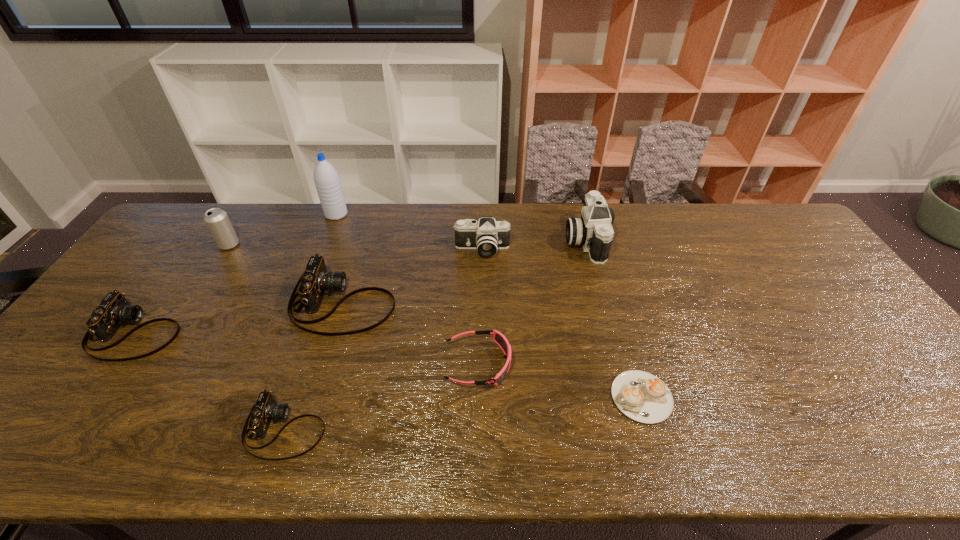
Identify the location of water bottle. The image size is (960, 540). (326, 178).

The image size is (960, 540). What are the coordinates of `blue water bottle` in the screenshot? It's located at (326, 178).

At what (x,y) coordinates should I click in order to perform the action: click on the rightmost camera. Please return your answer as a coordinate pair (x, y). The height and width of the screenshot is (540, 960). Looking at the image, I should click on (593, 231).

The image size is (960, 540). I want to click on the tallest camera, so click(x=593, y=231).

Where is `white beer can`? white beer can is located at coordinates (217, 221).

Where is `the smaller black camera`? This screenshot has height=540, width=960. the smaller black camera is located at coordinates (487, 235).

The height and width of the screenshot is (540, 960). I want to click on the second tallest camera, so click(x=487, y=235).

What are the coordinates of `the fifth shortest object` in the screenshot? It's located at click(x=315, y=281).

This screenshot has width=960, height=540. Identify the location of the biggest brown camera. (315, 281).

Identify the location of the leftmost camera. (114, 310).